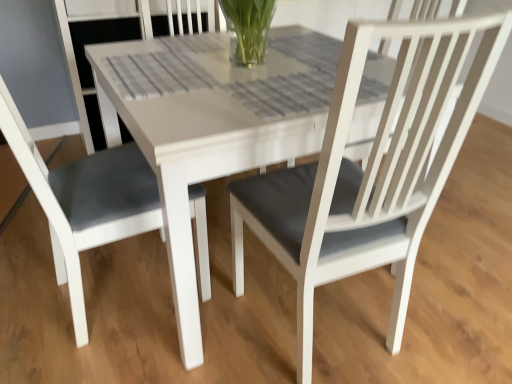
Question: Considering their positions, is white matte table at center located in front of or behind matte gray cushion at left?

Choices:
 (A) behind
 (B) front

Answer: (A)

Question: In the image, is white matte table at center on the left side or the right side of matte gray cushion at left?

Choices:
 (A) right
 (B) left

Answer: (A)

Question: Would you say white matte table at center is inside or outside matte gray cushion at left?

Choices:
 (A) inside
 (B) outside

Answer: (B)

Question: Considering the positions of matte gray cushion at left and white matte table at center in the image, is matte gray cushion at left taller or shorter than white matte table at center?

Choices:
 (A) tall
 (B) short

Answer: (A)

Question: In terms of size, does matte gray cushion at left appear bigger or smaller than white matte table at center?

Choices:
 (A) small
 (B) big

Answer: (A)

Question: Considering the positions of matte gray cushion at left and white matte table at center in the image, is matte gray cushion at left wider or thinner than white matte table at center?

Choices:
 (A) wide
 (B) thin

Answer: (B)

Question: From a real-world perspective, is matte gray cushion at left positioned above or below white matte table at center?

Choices:
 (A) above
 (B) below

Answer: (A)